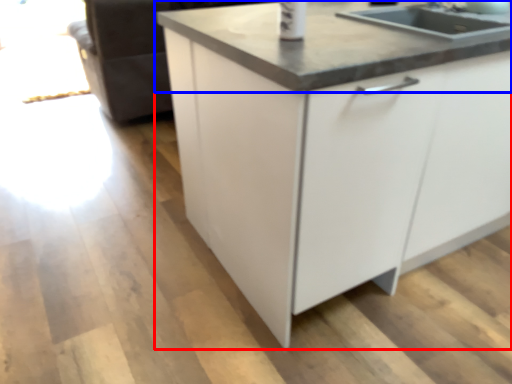
Question: Which object is closer to the camera taking this photo, cabinetry (highlighted by a red box) or countertop (highlighted by a blue box)?

Choices:
 (A) cabinetry
 (B) countertop

Answer: (A)